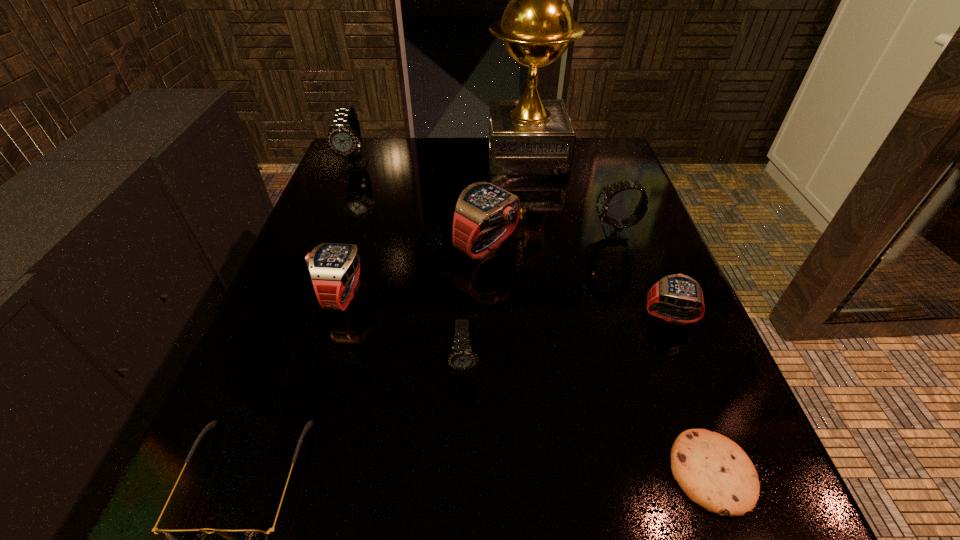
This screenshot has height=540, width=960. In order to click on gold award in this screenshot , I will do `click(529, 136)`.

Where is `award`? award is located at coordinates pyautogui.click(x=529, y=136).

The width and height of the screenshot is (960, 540). What are the coordinates of `the farthest gray watch` in the screenshot? It's located at (344, 137).

What are the coordinates of `the eighth shortest object` in the screenshot? It's located at (344, 137).

You are a GUI agent. You are given a task and a screenshot of the screen. Output one action in this format:
    pyautogui.click(x=<x>, y=<y>)
    Task: Click on the second red watch from left to right
    This screenshot has height=540, width=960.
    Given the screenshot: What is the action you would take?
    pyautogui.click(x=482, y=206)

The width and height of the screenshot is (960, 540). Identify the location of the biggest red watch. (482, 206).

Locate an element on the screen. This screenshot has height=540, width=960. the second nearest gray watch is located at coordinates (616, 229).

In order to click on the second biggest gray watch in this screenshot , I will do `click(616, 229)`.

Identify the location of the second smallest red watch. Image resolution: width=960 pixels, height=540 pixels. (334, 268).

Identify the location of the nearest watch. This screenshot has height=540, width=960. (461, 358).